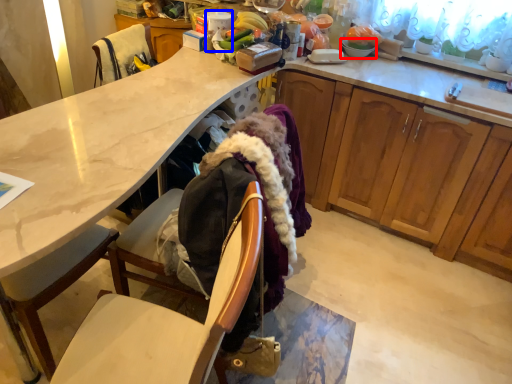
Question: Which of the following is the closest to the observer, tableware (highlighted by a red box) or kitchen appliance (highlighted by a blue box)?

Choices:
 (A) tableware
 (B) kitchen appliance

Answer: (B)